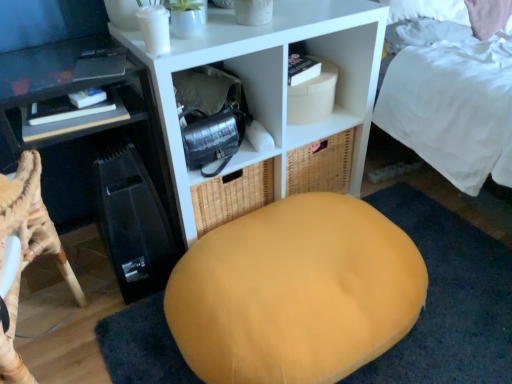
Image resolution: width=512 pixels, height=384 pixels. I want to click on empty space that is to the right of white matte shelf at center, the first shelf from the right, so pyautogui.click(x=423, y=212).